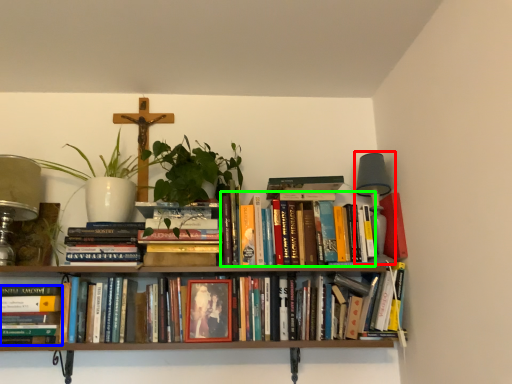
Question: Which is farther away from table lamp (highlighted by a red box)? book (highlighted by a blue box) or book (highlighted by a green box)?

Choices:
 (A) book
 (B) book

Answer: (A)